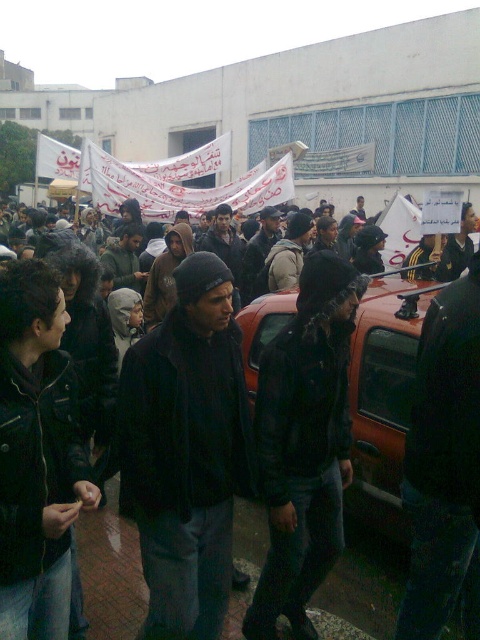
Question: Which point is farther to the camera?

Choices:
 (A) (383, 356)
 (B) (300, 310)
 (C) (165, 388)

Answer: (A)

Question: Estimate the real-world distances between objects in this image. Which object is closer to the black matte jacket at center?

Choices:
 (A) black leather jacket at center
 (B) orange matte car at center

Answer: (A)

Question: From the image, what is the correct spatial relationship of black leather jacket at center in relation to orange matte car at center?

Choices:
 (A) below
 (B) above

Answer: (A)

Question: Is black matte jacket at center to the left of black leather jacket at center from the viewer's perspective?

Choices:
 (A) yes
 (B) no

Answer: (A)

Question: Which is nearer to the orange matte car at center?

Choices:
 (A) black leather jacket at center
 (B) black matte jacket at center

Answer: (A)

Question: Can you confirm if black matte jacket at center is positioned below orange matte car at center?

Choices:
 (A) no
 (B) yes

Answer: (B)